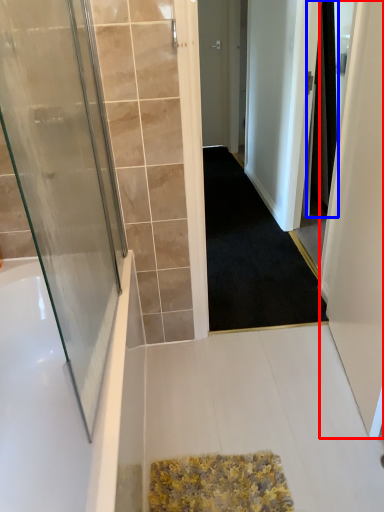
Question: Among these objects, which one is farthest to the camera, screen door (highlighted by a red box) or shower curtain (highlighted by a blue box)?

Choices:
 (A) screen door
 (B) shower curtain

Answer: (B)